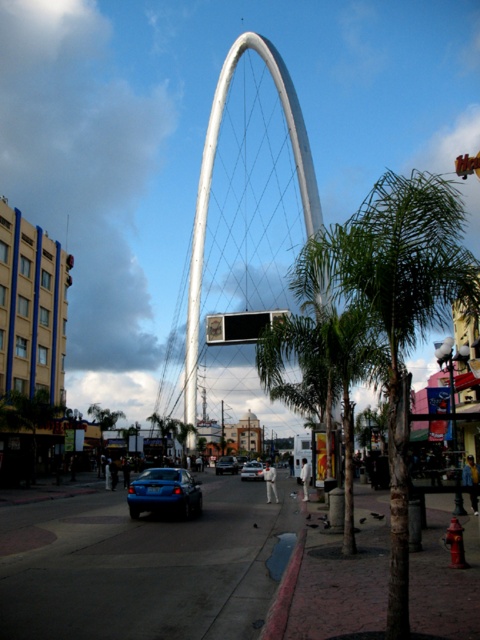
Question: Which point is farther from the camera taking this photo?

Choices:
 (A) (286, 72)
 (B) (396, 483)
 (C) (220, 470)

Answer: (A)

Question: Is white metallic arch at center further to the viewer compared to blue glossy sedan at center?

Choices:
 (A) no
 (B) yes

Answer: (A)

Question: Which point is closer to the camera?

Choices:
 (A) white metallic arch at center
 (B) green leafy palm tree at center
 (C) shiny blue car at center
 (D) blue glossy sedan at center

Answer: (B)

Question: Does white metallic arch at center appear over blue glossy sedan at center?

Choices:
 (A) no
 (B) yes

Answer: (B)

Question: Does shiny blue car at center have a larger size compared to blue glossy sedan at center?

Choices:
 (A) yes
 (B) no

Answer: (B)

Question: Which object is farther from the camera taking this photo?

Choices:
 (A) shiny blue car at center
 (B) white metallic arch at center
 (C) green leafy palm tree at center
 (D) blue metallic car at center

Answer: (B)